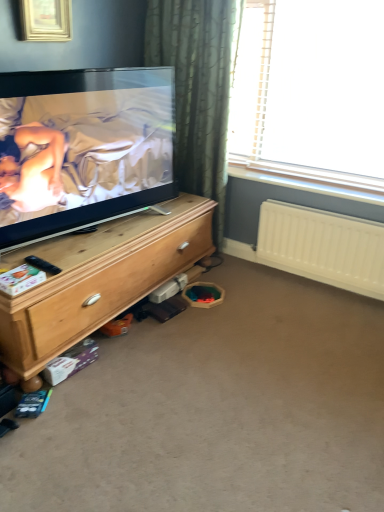
Identify the location of vacant space to the right of black plastic remote control at lower left. (71, 263).